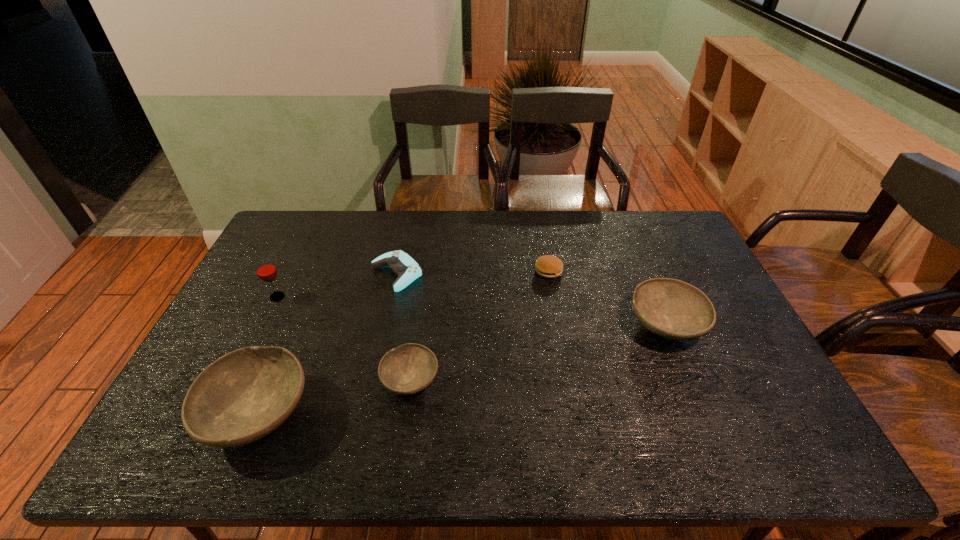
Locate an element on the screen. This screenshot has width=960, height=540. vacant space located on the back of the rightmost bowl is located at coordinates (644, 274).

The height and width of the screenshot is (540, 960). Find the location of `free space located 0.360m on the left of the control`. free space located 0.360m on the left of the control is located at coordinates (260, 274).

Identify the location of vacant space situated 0.400m on the front of the second object from right to left. The width and height of the screenshot is (960, 540). (568, 387).

This screenshot has width=960, height=540. In order to click on vacant space located on the back of the tallest object in this screenshot , I will do `click(286, 278)`.

Where is `bowl present at the left edge`? The image size is (960, 540). bowl present at the left edge is located at coordinates (243, 396).

At what (x,y) coordinates should I click in order to perform the action: click on glass at the left edge. Please return your answer as a coordinate pair (x, y). This screenshot has width=960, height=540. Looking at the image, I should click on coord(266,271).

Where is `object located in the right edge section of the desktop`? object located in the right edge section of the desktop is located at coordinates point(670,308).

This screenshot has width=960, height=540. What are the coordinates of `object positioned at the near left corner` in the screenshot? It's located at (243, 396).

The width and height of the screenshot is (960, 540). In the image, there is a desktop. What are the coordinates of `free space at the far edge` in the screenshot? It's located at (418, 212).

Image resolution: width=960 pixels, height=540 pixels. I want to click on blank space at the near edge of the desktop, so click(672, 406).